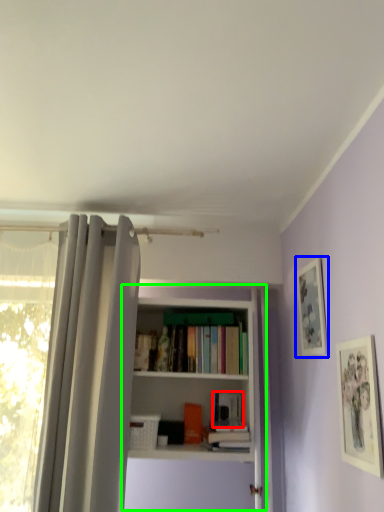
Question: Which is farther away from book (highlighted by a red box)? picture frame (highlighted by a blue box) or bookcase (highlighted by a green box)?

Choices:
 (A) picture frame
 (B) bookcase

Answer: (A)